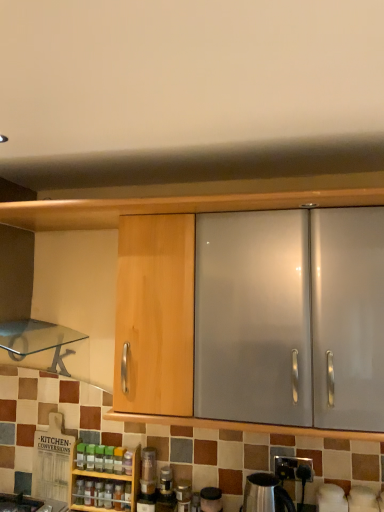
Question: Considering the positions of point (120, 499) and point (97, 463), is point (120, 499) closer or farther from the camera than point (97, 463)?

Choices:
 (A) closer
 (B) farther

Answer: (A)

Question: From a real-world perspective, is translucent plastic bottle at center, the third bottle positioned from the right, physically located above or below green plastic bottle at center, which is the 6th bottle in right-to-left order?

Choices:
 (A) below
 (B) above

Answer: (A)

Question: Which object is positioned farthest from the metallic silver kettle at center, marked as the first appliance in a left-to-right arrangement?

Choices:
 (A) translucent plastic bottle at center, positioned as the 2th bottle in left-to-right order
 (B) wooden spice rack at lower center
 (C) satin silver kettle at lower center, marked as the second appliance in a right-to-left arrangement
 (D) translucent plastic bottle at center, the third bottle positioned from the right
 (E) translucent plastic spice bottle at lower left, the 5th bottle in the left-to-right sequence

Answer: (A)

Question: Which object is the farthest from the translucent plastic bottle at center, arranged as the 7th bottle when viewed from the right?

Choices:
 (A) translucent glass jar at lower center, which is the first bottle in right-to-left order
 (B) translucent plastic spice bottle at lower left, the fourth bottle positioned from the right
 (C) translucent plastic spice at center, the second bottle positioned from the right
 (D) satin silver kettle at lower center, marked as the second appliance in a right-to-left arrangement
 (E) translucent plastic bottles at center, which ranks as the eighth bottle in right-to-left order

Answer: (D)